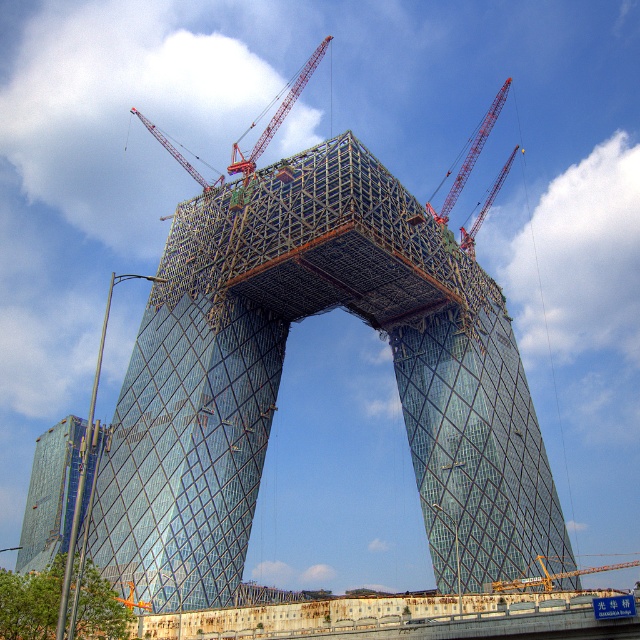
Question: From the image, what is the correct spatial relationship of yellow metallic crane at center in relation to red metal crane at upper right?

Choices:
 (A) left
 (B) right

Answer: (B)

Question: In this image, where is transparent glass skyscraper at center located relative to red metal crane at upper center?

Choices:
 (A) right
 (B) left

Answer: (A)

Question: Which point is farther from the camera taking this photo?

Choices:
 (A) (493, 362)
 (B) (440, 220)
 (C) (499, 182)

Answer: (C)

Question: Among these points, which one is farthest from the camera?

Choices:
 (A) (172, 147)
 (B) (472, 236)

Answer: (A)

Question: Does transparent glass skyscraper at center have a smaller size compared to red metallic crane at upper center?

Choices:
 (A) yes
 (B) no

Answer: (B)

Question: Which is nearer to the red metal crane at upper right?

Choices:
 (A) transparent glass skyscraper at left
 (B) yellow metallic crane at center

Answer: (B)